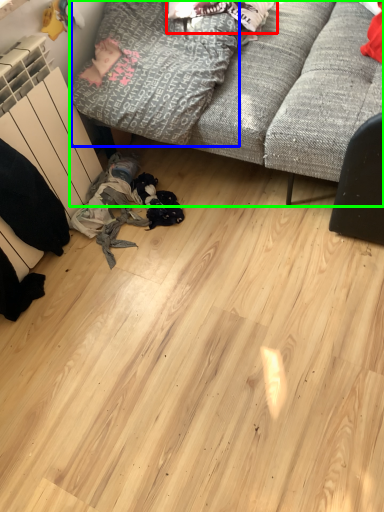
Question: Based on their relative distances, which object is farther from clothing (highlighted by a red box)? Choose from clothing (highlighted by a blue box) and studio couch (highlighted by a green box).

Choices:
 (A) clothing
 (B) studio couch

Answer: (B)